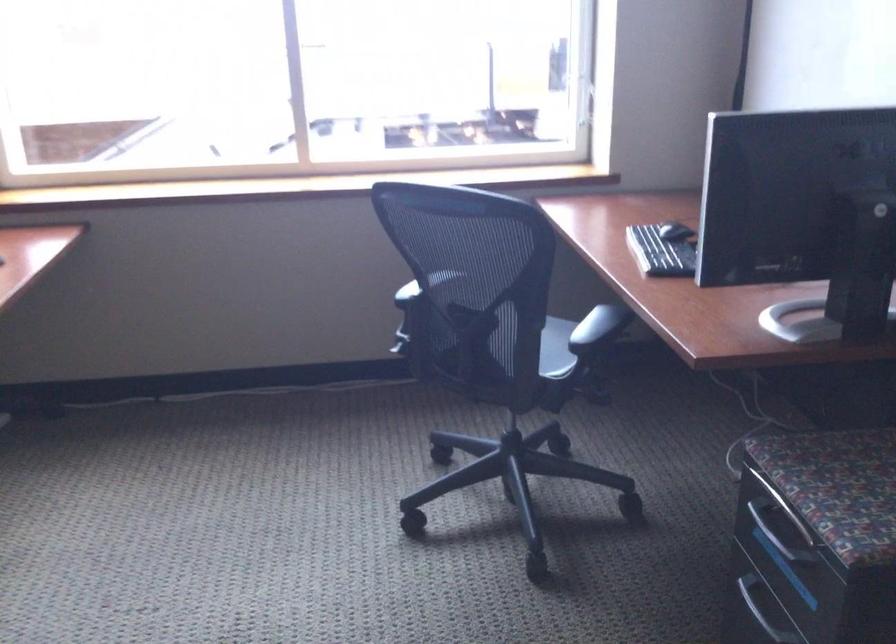
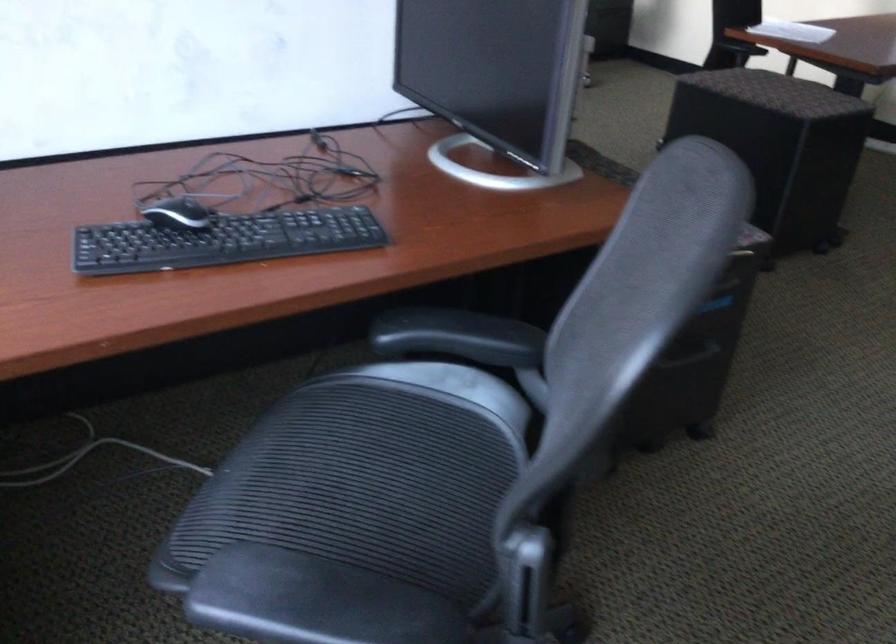
Question: I am providing you with two images of the same scene from different viewpoints. Please identify which objects are invisible in image2.

Choices:
 (A) silver drawer handle
 (B) black storage ottoman
 (C) black chair armrest
 (D) flower vase

Answer: (A)